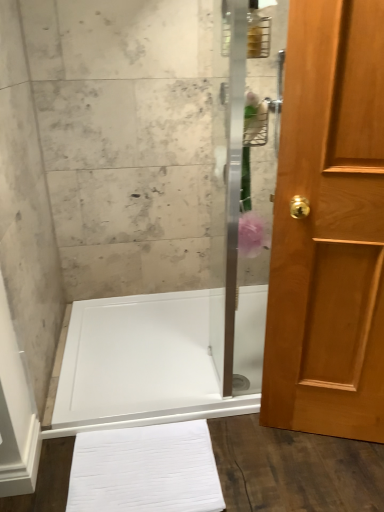
Question: In terms of height, does white glossy shower tray at center look taller or shorter compared to light brown wood door at right?

Choices:
 (A) short
 (B) tall

Answer: (A)

Question: Considering their positions, is white glossy shower tray at center located in front of or behind light brown wood door at right?

Choices:
 (A) front
 (B) behind

Answer: (B)

Question: Estimate the real-world distances between objects in this image. Which object is closer to the white glossy shower tray at center?

Choices:
 (A) white cotton bath towel at lower center
 (B) light brown wood door at right
 (C) clear glass shower door at center

Answer: (C)

Question: Based on their relative distances, which object is nearer to the light brown wood door at right?

Choices:
 (A) clear glass shower door at center
 (B) white cotton bath towel at lower center
 (C) white glossy shower tray at center

Answer: (B)